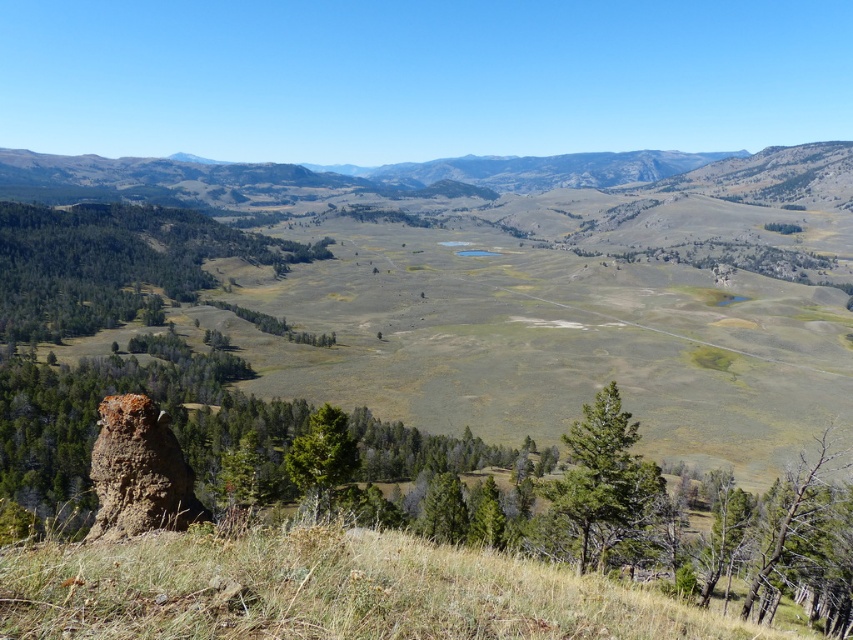
Question: Does dry grass at lower left appear over brown rough rock at lower left?

Choices:
 (A) no
 (B) yes

Answer: (A)

Question: Is dry grass at lower left further to camera compared to brown rough rock at lower left?

Choices:
 (A) yes
 (B) no

Answer: (B)

Question: Among these objects, which one is nearest to the camera?

Choices:
 (A) brown rough rock at lower left
 (B) dry grass at lower left

Answer: (B)

Question: Does dry grass at lower left appear under brown rough rock at lower left?

Choices:
 (A) yes
 (B) no

Answer: (A)

Question: Which point is closer to the camera taking this photo?

Choices:
 (A) [149, 502]
 (B) [209, 566]

Answer: (B)